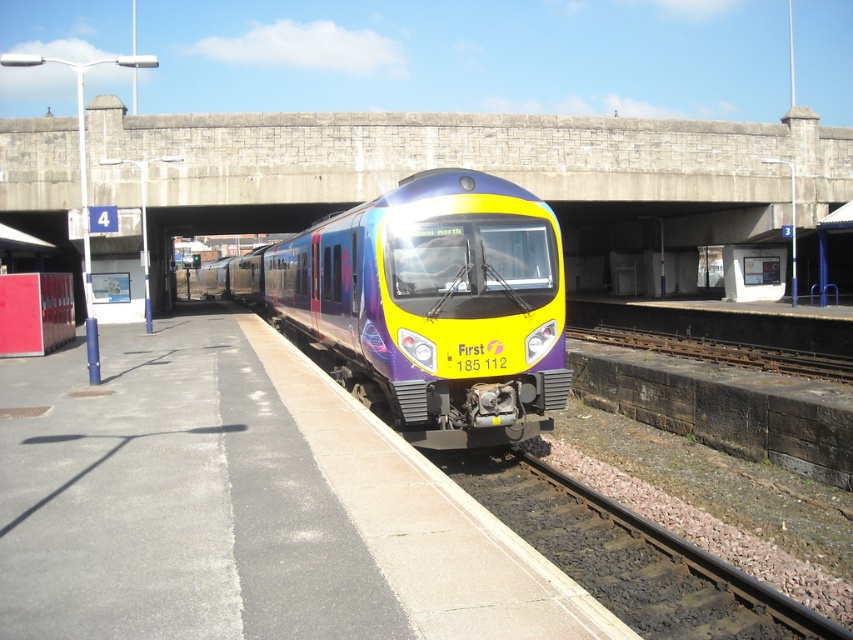
Is smooth concrete platform at center thinner than black gravel train track at lower center?

No.

The width and height of the screenshot is (853, 640). In order to click on smooth concrete platform at center in this screenshot , I will do `click(244, 506)`.

Describe the element at coordinates (244, 506) in the screenshot. I see `smooth concrete platform at center` at that location.

The width and height of the screenshot is (853, 640). Find the location of `smooth concrete platform at center`. smooth concrete platform at center is located at coordinates (244, 506).

Between smooth concrete platform at center and matte purple train at center, which one has more height?

matte purple train at center is taller.

Which is more to the left, smooth concrete platform at center or matte purple train at center?

matte purple train at center

Which is behind, point (310, 637) or point (544, 403)?

The point (544, 403) is more distant.

At what (x,y) coordinates should I click in order to perform the action: click on smooth concrete platform at center. Please return your answer as a coordinate pair (x, y). Image resolution: width=853 pixels, height=640 pixels. Looking at the image, I should click on (244, 506).

Does matte purple train at center appear on the left side of rusty metal track at lower right?

Correct, you'll find matte purple train at center to the left of rusty metal track at lower right.

At what (x,y) coordinates should I click in order to perform the action: click on matte purple train at center. Please return your answer as a coordinate pair (x, y). Image resolution: width=853 pixels, height=640 pixels. Looking at the image, I should click on (428, 305).

The image size is (853, 640). What are the coordinates of `matte purple train at center` in the screenshot? It's located at (428, 305).